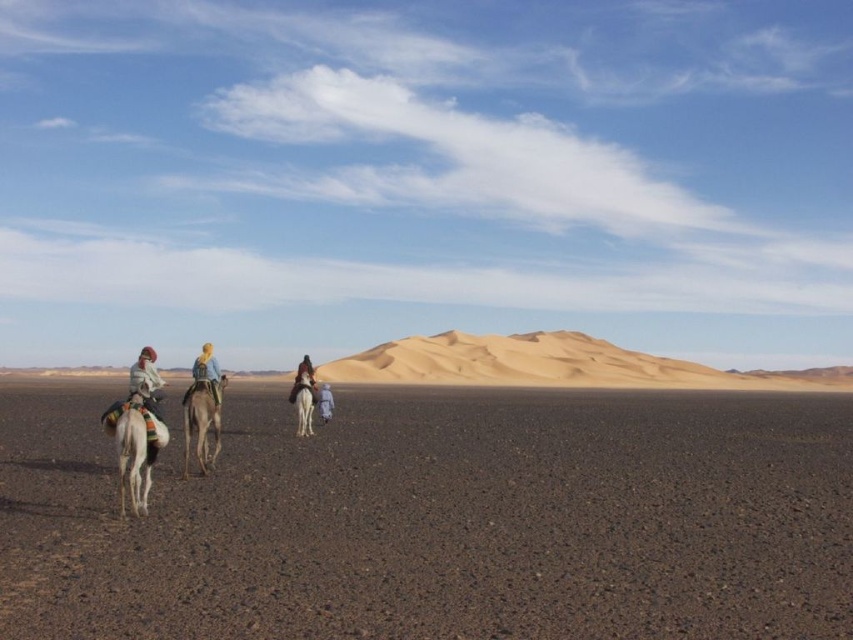
Consider the image. Between brown sandy dirt at lower center and light brown leather camel at center, which one is positioned higher?

light brown leather camel at center is above.

Is brown sandy dirt at lower center to the left of light brown leather camel at center from the viewer's perspective?

Incorrect, brown sandy dirt at lower center is not on the left side of light brown leather camel at center.

Is point (743, 588) closer to camera compared to point (213, 396)?

That is True.

Where is `brown sandy dirt at lower center`? The image size is (853, 640). brown sandy dirt at lower center is located at coordinates (438, 518).

Who is lower down, light brown leather camel at center or dark brown leather saddle at center?

dark brown leather saddle at center

Looking at this image, which is more to the left, light brown leather camel at center or dark brown leather saddle at center?

dark brown leather saddle at center

Between point (206, 374) and point (315, 397), which one is positioned behind?

Point (315, 397)

I want to click on light brown leather camel at center, so click(x=207, y=372).

From the picture: Which of these two, white woolen blanket at left or white fabric headscarf at center, stands shorter?

With less height is white woolen blanket at left.

From the picture: Between white woolen blanket at left and white fabric headscarf at center, which one has more height?

Standing taller between the two is white fabric headscarf at center.

Where is `white woolen blanket at left`? Image resolution: width=853 pixels, height=640 pixels. white woolen blanket at left is located at coordinates (146, 380).

Where is `white woolen blanket at left`? Image resolution: width=853 pixels, height=640 pixels. white woolen blanket at left is located at coordinates [x=146, y=380].